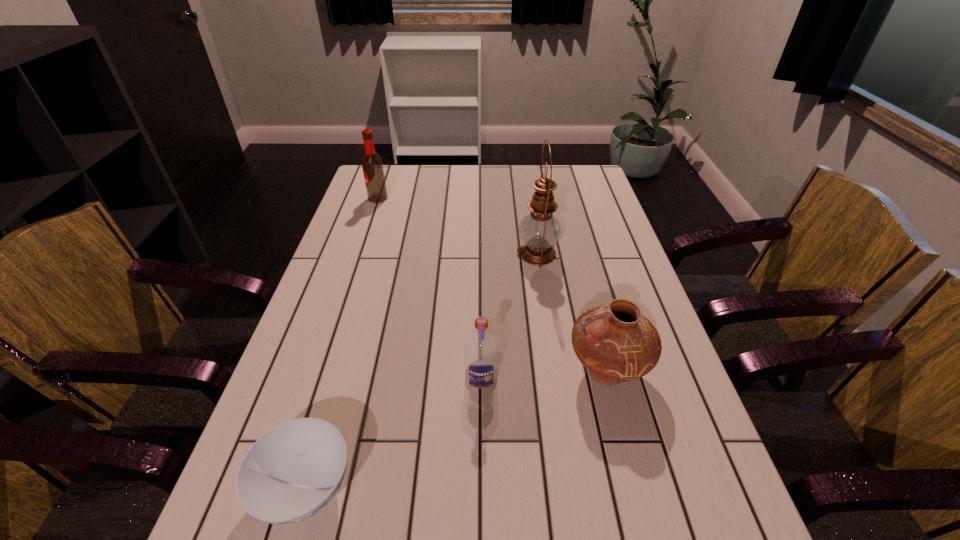
At what (x,y) coordinates should I click in order to perform the action: click on vacant space located on the side of the pottery with the handle. Please return your answer as a coordinate pair (x, y). This screenshot has width=960, height=540. Looking at the image, I should click on (418, 371).

Where is `vacant region located 0.090m on the label of the third object from right to left`? vacant region located 0.090m on the label of the third object from right to left is located at coordinates (481, 429).

Find the location of `object present at the far edge`. object present at the far edge is located at coordinates (372, 165).

You are a GUI agent. You are given a task and a screenshot of the screen. Output one action in this format:
    pyautogui.click(x=<x>, y=<y>)
    Task: Click on the object situated at the left edge
    
    Given the screenshot: What is the action you would take?
    pyautogui.click(x=372, y=165)

You are a GUI agent. You are given a task and a screenshot of the screen. Output one action in this format:
    pyautogui.click(x=<x>, y=<y>)
    Task: Click on the object located in the right edge section of the desktop
    This screenshot has height=540, width=960.
    Given the screenshot: What is the action you would take?
    pyautogui.click(x=616, y=343)

Identify the location of object that is at the far left corner. (372, 165).

Where is `free location at the left edge`? The height and width of the screenshot is (540, 960). free location at the left edge is located at coordinates (340, 309).

What are the coordinates of `vacant area at the right edge of the desktop` in the screenshot? It's located at (591, 201).

The height and width of the screenshot is (540, 960). In order to click on free location at the far right corner of the desktop in this screenshot , I will do `click(571, 193)`.

Locate an element on the screen. This screenshot has width=960, height=540. free area in between the beer bottle and the pottery is located at coordinates (492, 285).